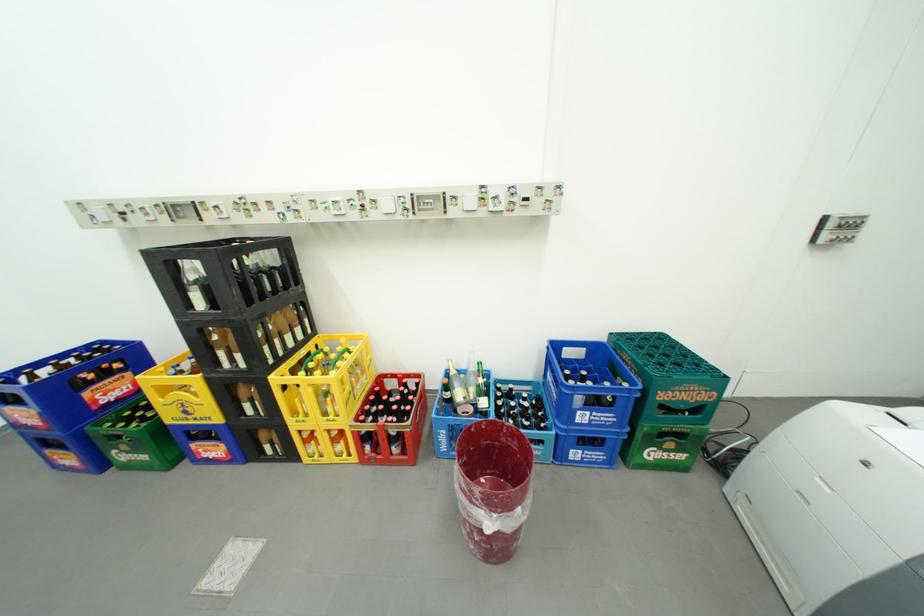
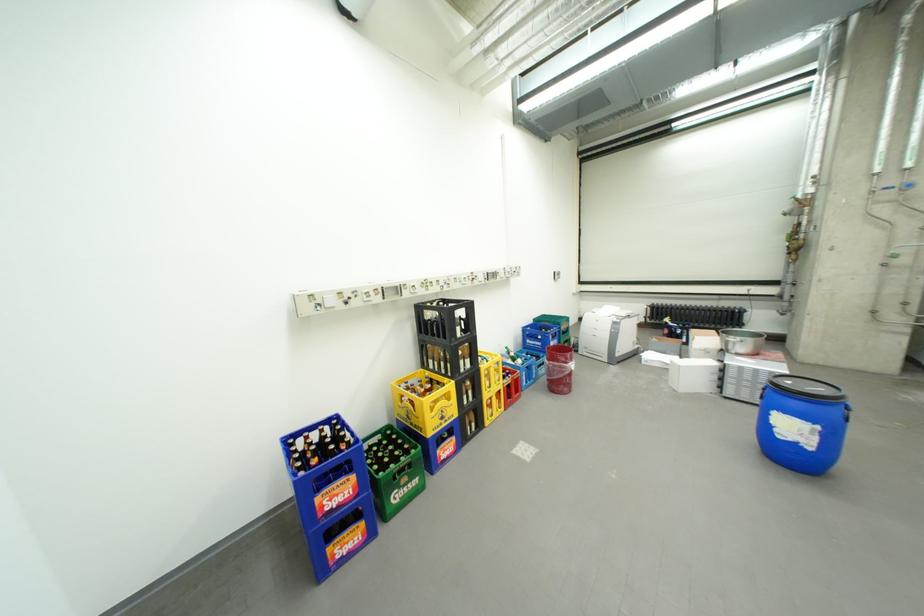
In the second image, find the point that corresponds to (217,305) in the first image.

(470, 333)